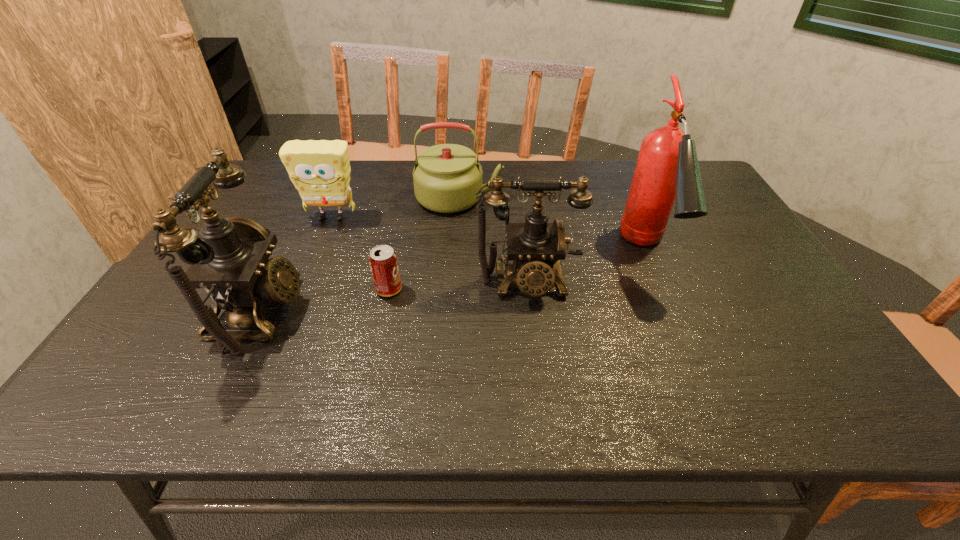
You are a GUI agent. You are given a task and a screenshot of the screen. Output one action in this format:
    pyautogui.click(x=<x>, y=<y>)
    Task: Click on the left telephone
    The width and height of the screenshot is (960, 540).
    Given the screenshot: What is the action you would take?
    pyautogui.click(x=231, y=262)

The width and height of the screenshot is (960, 540). I want to click on the second tallest object, so click(x=231, y=262).

Identify the location of the shorter telephone. The height and width of the screenshot is (540, 960). (535, 247).

In order to click on the right telephone in this screenshot , I will do `click(535, 247)`.

The height and width of the screenshot is (540, 960). Identify the location of sponge. (320, 170).

At what (x,y) coordinates should I click in order to perform the action: click on kettle. Please return your answer as a coordinate pair (x, y). Looking at the image, I should click on (446, 177).

This screenshot has height=540, width=960. In order to click on the rightmost object in this screenshot , I will do [x=667, y=168].

I want to click on the shortest object, so click(383, 261).

Where is `vacant space located 0.240m on the rotary dial of the taller telephone`? The image size is (960, 540). vacant space located 0.240m on the rotary dial of the taller telephone is located at coordinates (403, 312).

Locate an element on the screen. This screenshot has height=540, width=960. vacant region located on the rotary dial of the right telephone is located at coordinates (535, 355).